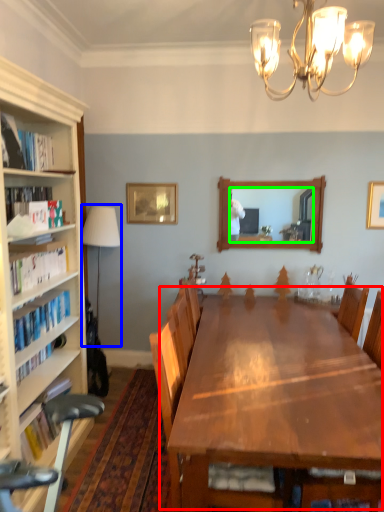
Question: Which is nearer to the table (highlighted by a red box)? lamp (highlighted by a blue box) or mirror (highlighted by a green box).

Choices:
 (A) lamp
 (B) mirror

Answer: (A)